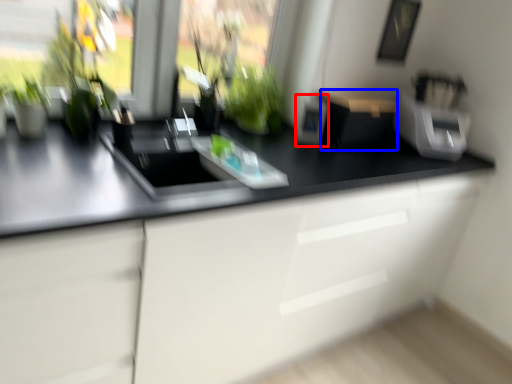
Question: Which of the following is the closest to the observer, appliance (highlighted by a red box) or appliance (highlighted by a blue box)?

Choices:
 (A) appliance
 (B) appliance

Answer: (B)